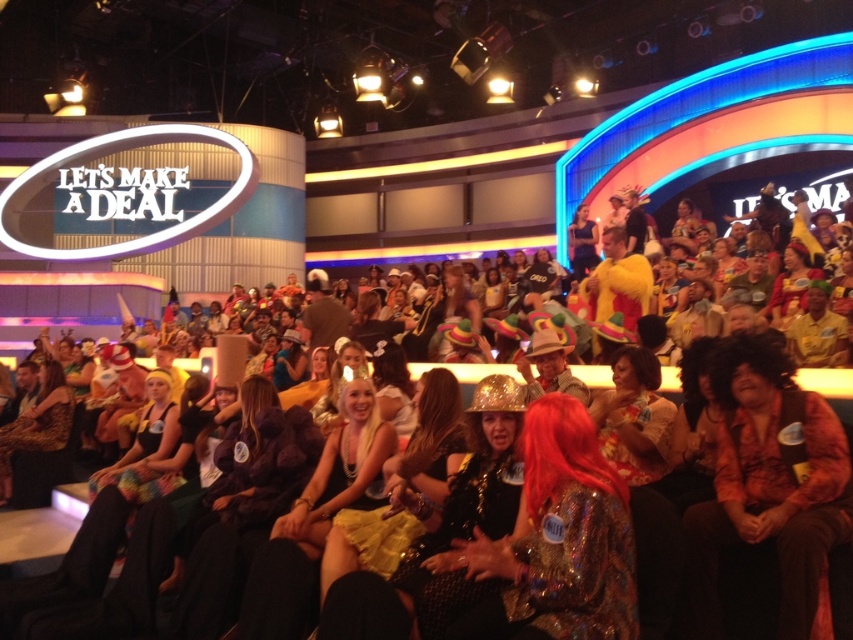
Who is shorter, orange textured shirt at center or shiny metallic hat at center?

Standing shorter between the two is shiny metallic hat at center.

Which is more to the left, orange textured shirt at center or shiny metallic hat at center?

shiny metallic hat at center is more to the left.

Measure the distance between point (x=683, y=589) and camera.

Point (x=683, y=589) and camera are 75.97 feet apart.

Identify the location of orange textured shirt at center. (767, 484).

Which is above, shiny metallic hats at center or leather jacket at lower left?

shiny metallic hats at center

Does shiny metallic hats at center have a greater height compared to leather jacket at lower left?

Yes, shiny metallic hats at center is taller than leather jacket at lower left.

Between point (93, 536) and point (15, 449), which one is positioned in front?

Positioned in front is point (93, 536).

Where is `shiny metallic hats at center`? This screenshot has height=640, width=853. shiny metallic hats at center is located at coordinates 656,554.

Can you confirm if shiny metallic hat at center is taller than shiny metallic hats at center?

Incorrect, shiny metallic hat at center's height is not larger of shiny metallic hats at center's.

Image resolution: width=853 pixels, height=640 pixels. Find the location of `shiny metallic hat at center`. shiny metallic hat at center is located at coordinates (558, 541).